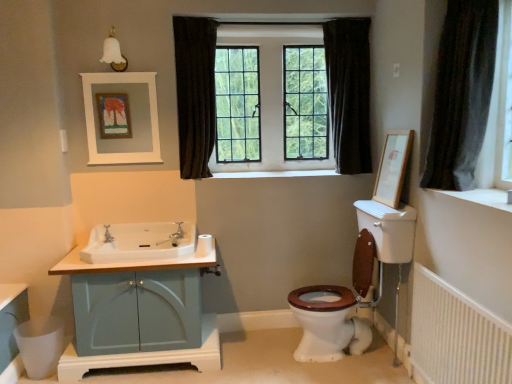
Find the location of a particular element. The width and height of the screenshot is (512, 384). free space in front of white matte toilet paper at sink is located at coordinates (193, 253).